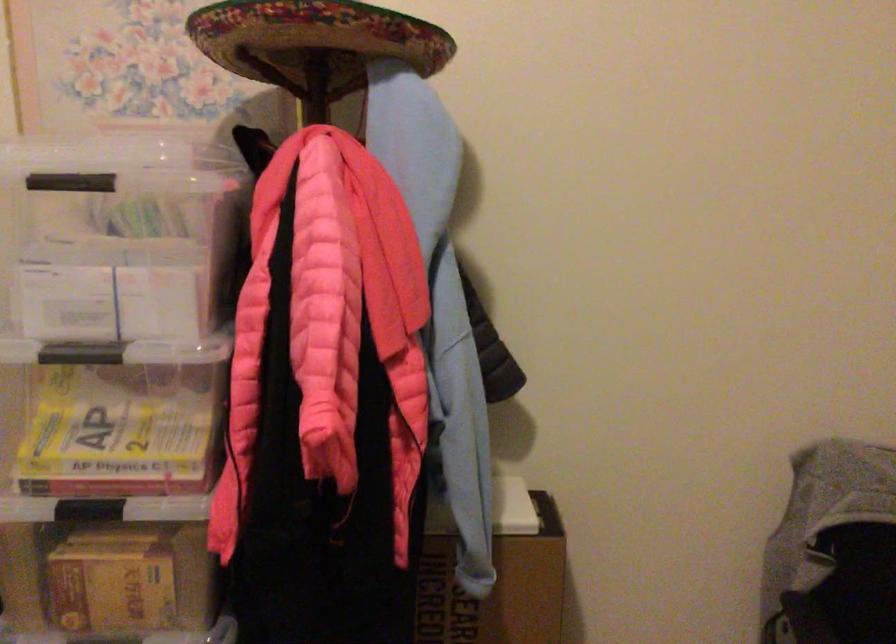
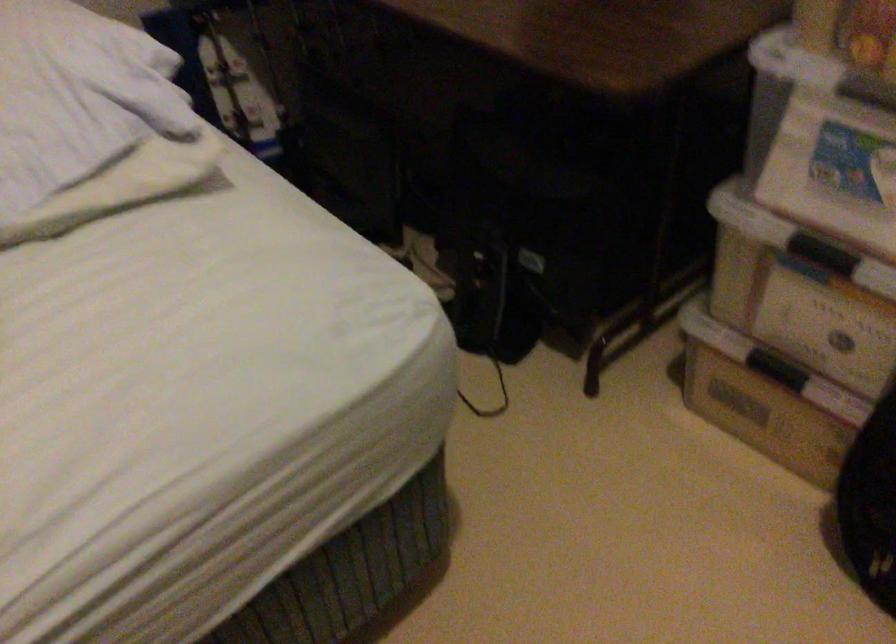
How did the camera likely rotate?

The camera rotated toward left-down.